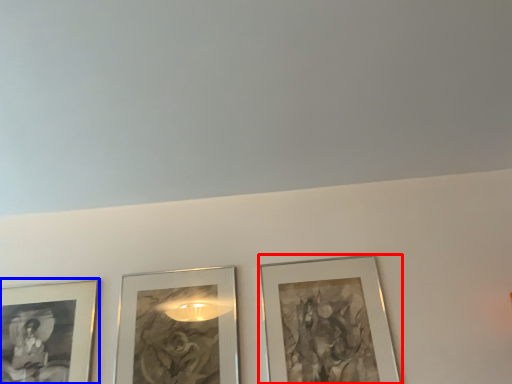
Question: Which of the following is the closest to the observer, picture frame (highlighted by a red box) or picture frame (highlighted by a blue box)?

Choices:
 (A) picture frame
 (B) picture frame

Answer: (A)